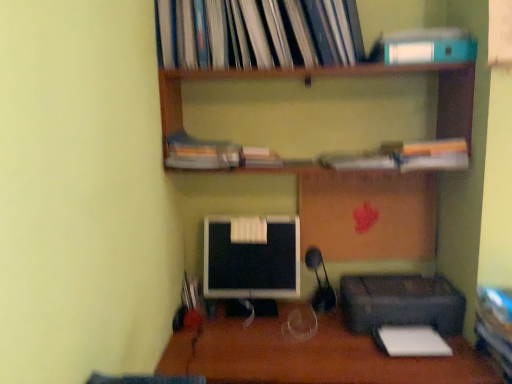
This screenshot has height=384, width=512. Find the location of `vacant space to the left of white paper at lower right`. vacant space to the left of white paper at lower right is located at coordinates (360, 350).